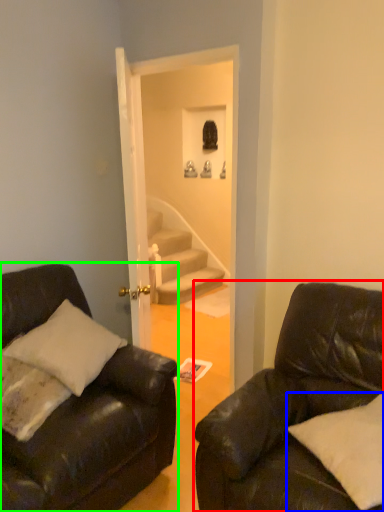
Question: Which object is positioned farthest from studio couch (highlighted by a red box)? Select from pillow (highlighted by a blue box) and studio couch (highlighted by a green box).

Choices:
 (A) pillow
 (B) studio couch

Answer: (B)